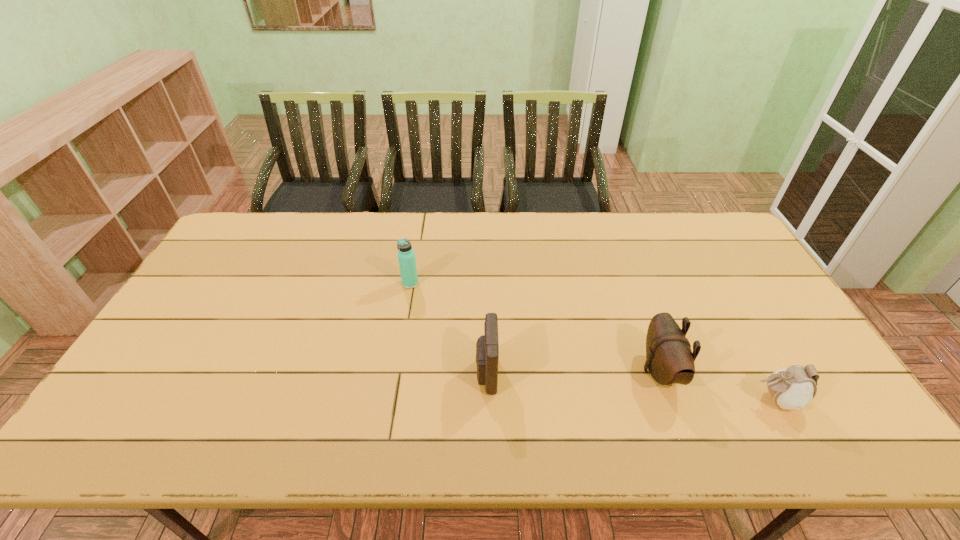
Image resolution: width=960 pixels, height=540 pixels. In the image, there is a desktop. Identify the location of vacant area at the near edge. (492, 450).

This screenshot has width=960, height=540. In order to click on vacant space at the left edge in this screenshot , I will do `click(213, 300)`.

In the image, there is a desktop. Where is `vacant space at the right edge`? The width and height of the screenshot is (960, 540). vacant space at the right edge is located at coordinates (729, 289).

You are a GUI agent. You are given a task and a screenshot of the screen. Output one action in this format:
    pyautogui.click(x=<x>, y=<y>)
    Task: Click on the vacant area at the far left corner of the desktop
    The height and width of the screenshot is (540, 960).
    Given the screenshot: What is the action you would take?
    pyautogui.click(x=279, y=221)

Locate an element on the screen. free location at the far right corner of the desktop is located at coordinates (691, 225).

The image size is (960, 540). In order to click on vacant area that lies between the leftmost pouch and the second pouch from right to left in this screenshot , I will do `click(573, 372)`.

Find the location of a particular element. The image size is (960, 540). free space between the rightmost object and the second pouch from right to left is located at coordinates (718, 385).

In order to click on free space that is in between the third object from left to right and the farthest object in this screenshot , I will do `click(535, 327)`.

This screenshot has height=540, width=960. I want to click on free space that is in between the leftmost pouch and the thermos bottle, so click(x=448, y=328).

Where is `free space between the second object from left to right and the shortest pouch`? This screenshot has height=540, width=960. free space between the second object from left to right and the shortest pouch is located at coordinates (x=631, y=387).